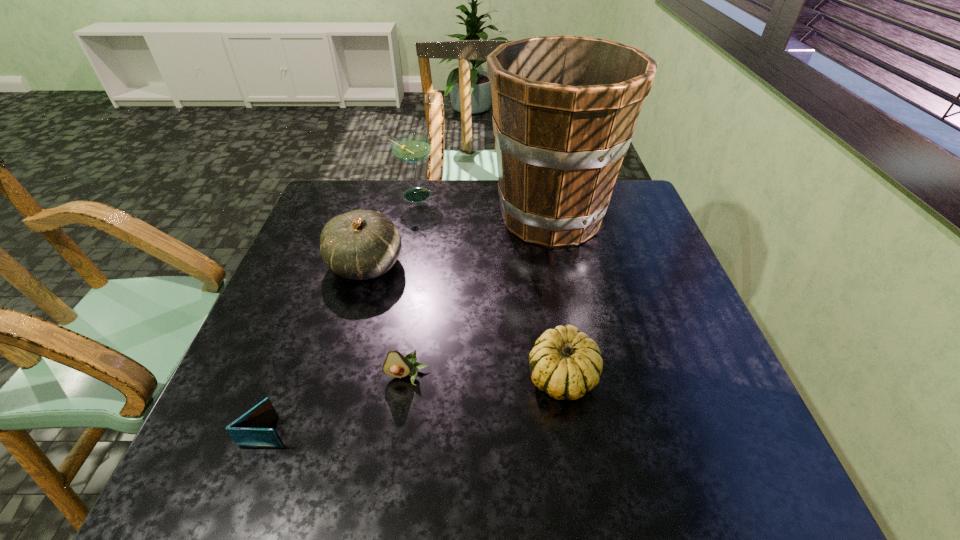
The image size is (960, 540). I want to click on vacant area located on the front of the second tallest object, so click(x=405, y=246).

Where is `free space located on the front of the left gourd`? The width and height of the screenshot is (960, 540). free space located on the front of the left gourd is located at coordinates (354, 306).

This screenshot has width=960, height=540. Identify the location of vacant space located 0.140m on the left of the right gourd. (460, 377).

I want to click on vacant space located 0.110m on the seed side of the fifth tallest object, so click(398, 436).

Locate an element on the screen. This screenshot has height=540, width=960. vacant space situated on the exterior surface of the wallet is located at coordinates (444, 431).

Find the location of a particular element. bucket at the far edge is located at coordinates (565, 108).

The height and width of the screenshot is (540, 960). I want to click on martini that is at the far edge, so coord(411,148).

I want to click on object located in the near edge section of the desktop, so click(250, 430).

This screenshot has width=960, height=540. I want to click on gourd positioned at the left edge, so click(x=361, y=244).

The image size is (960, 540). I want to click on wallet situated at the left edge, so click(250, 430).